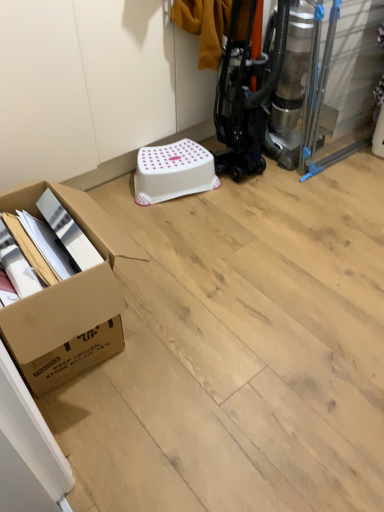
Measure the distance between point (181,180) and camera.

A distance of 5.86 feet exists between point (181,180) and camera.

Locate an element on the screen. The height and width of the screenshot is (512, 384). white plastic stool at center is located at coordinates (173, 172).

What do you see at coordinates (173, 172) in the screenshot? This screenshot has width=384, height=512. I see `white plastic stool at center` at bounding box center [173, 172].

Where is `brown cardboard box at lower left`? This screenshot has width=384, height=512. brown cardboard box at lower left is located at coordinates (68, 298).

Image resolution: width=384 pixels, height=512 pixels. Describe the element at coordinates (68, 298) in the screenshot. I see `brown cardboard box at lower left` at that location.

At what (x,y) coordinates should I click in order to perform the action: click on white plastic stool at center. Please return your answer as a coordinate pair (x, y). Looking at the image, I should click on (173, 172).

Which is more to the right, white plastic stool at center or brown cardboard box at lower left?

white plastic stool at center is more to the right.

Between white plastic stool at center and brown cardboard box at lower left, which one is positioned in front?

Positioned in front is brown cardboard box at lower left.

Is point (188, 182) closer to camera compared to point (84, 215)?

No, it is behind (84, 215).

From the image's perspective, which one is positioned higher, white plastic stool at center or brown cardboard box at lower left?

white plastic stool at center appears higher in the image.

From a real-world perspective, who is located lower, white plastic stool at center or brown cardboard box at lower left?

white plastic stool at center is physically lower.

Can you confirm if white plastic stool at center is wider than brown cardboard box at lower left?

In fact, white plastic stool at center might be narrower than brown cardboard box at lower left.

Can you confirm if white plastic stool at center is shorter than brown cardboard box at lower left?

Yes, white plastic stool at center is shorter than brown cardboard box at lower left.

Who is bigger, white plastic stool at center or brown cardboard box at lower left?

With larger size is brown cardboard box at lower left.

Is white plastic stool at center completely or partially outside of brown cardboard box at lower left?

Yes, white plastic stool at center is located beyond the bounds of brown cardboard box at lower left.

Looking at this image, are white plastic stool at center and brown cardboard box at lower left located far from each other?

No, white plastic stool at center is not far away from brown cardboard box at lower left.

Is white plastic stool at center turned away from brown cardboard box at lower left?

white plastic stool at center does not have its back to brown cardboard box at lower left.

What's the angular difference between white plastic stool at center and brown cardboard box at lower left's facing directions?

107 degrees.

I want to click on stool above the brown cardboard box at lower left (from the image's perspective), so pyautogui.click(x=173, y=172).

Considering the positions of objects brown cardboard box at lower left and white plastic stool at center in the image provided, who is more to the right, brown cardboard box at lower left or white plastic stool at center?

white plastic stool at center is more to the right.

Which object is further away from the camera, brown cardboard box at lower left or white plastic stool at center?

white plastic stool at center is further away from the camera.

Is point (41, 298) closer or farther from the camera than point (164, 164)?

Point (41, 298) is positioned closer to the camera compared to point (164, 164).

From the image's perspective, who appears lower, brown cardboard box at lower left or white plastic stool at center?

brown cardboard box at lower left, from the image's perspective.

From a real-world perspective, is brown cardboard box at lower left above or below white plastic stool at center?

Clearly, from a real-world perspective, brown cardboard box at lower left is above white plastic stool at center.

In terms of width, does brown cardboard box at lower left look wider or thinner when compared to white plastic stool at center?

brown cardboard box at lower left is wider than white plastic stool at center.

Looking at this image, in terms of height, does brown cardboard box at lower left look taller or shorter compared to white plastic stool at center?

Clearly, brown cardboard box at lower left is taller compared to white plastic stool at center.

Looking at this image, considering the relative sizes of brown cardboard box at lower left and white plastic stool at center in the image provided, is brown cardboard box at lower left smaller than white plastic stool at center?

No, brown cardboard box at lower left is not smaller than white plastic stool at center.

Would you say white plastic stool at center is part of brown cardboard box at lower left's contents?

That's incorrect, white plastic stool at center is not inside brown cardboard box at lower left.

Is brown cardboard box at lower left next to white plastic stool at center?

brown cardboard box at lower left and white plastic stool at center are not in contact.

Is brown cardboard box at lower left aimed at white plastic stool at center?

Yes.

How different are the orientations of brown cardboard box at lower left and white plastic stool at center in degrees?

The angle between the facing direction of brown cardboard box at lower left and the facing direction of white plastic stool at center is 107 degrees.

Where is `box below the white plastic stool at center (from the image's perspective)`? This screenshot has height=512, width=384. box below the white plastic stool at center (from the image's perspective) is located at coordinates (68, 298).

The width and height of the screenshot is (384, 512). I want to click on box in front of the white plastic stool at center, so click(x=68, y=298).

This screenshot has width=384, height=512. I want to click on stool that appears on the right of brown cardboard box at lower left, so click(173, 172).